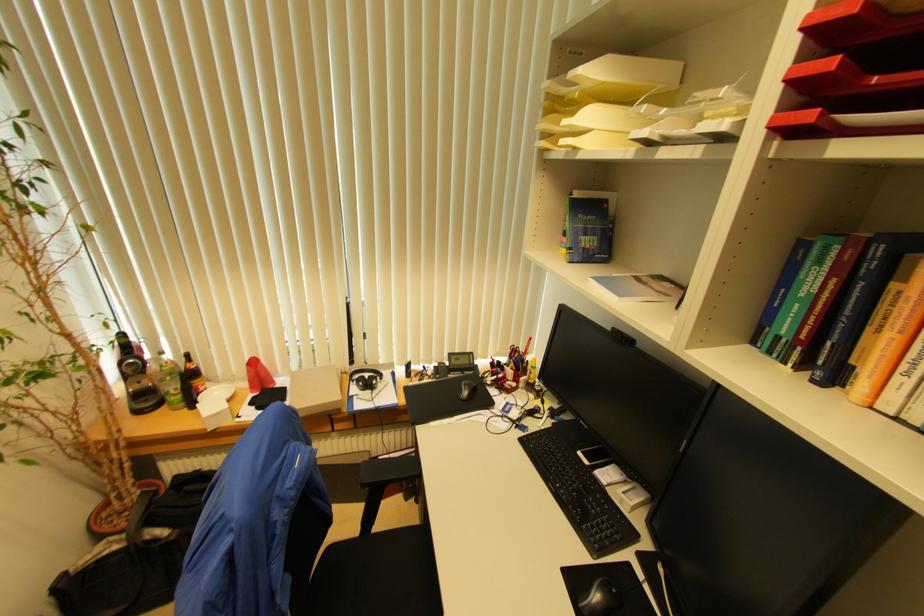
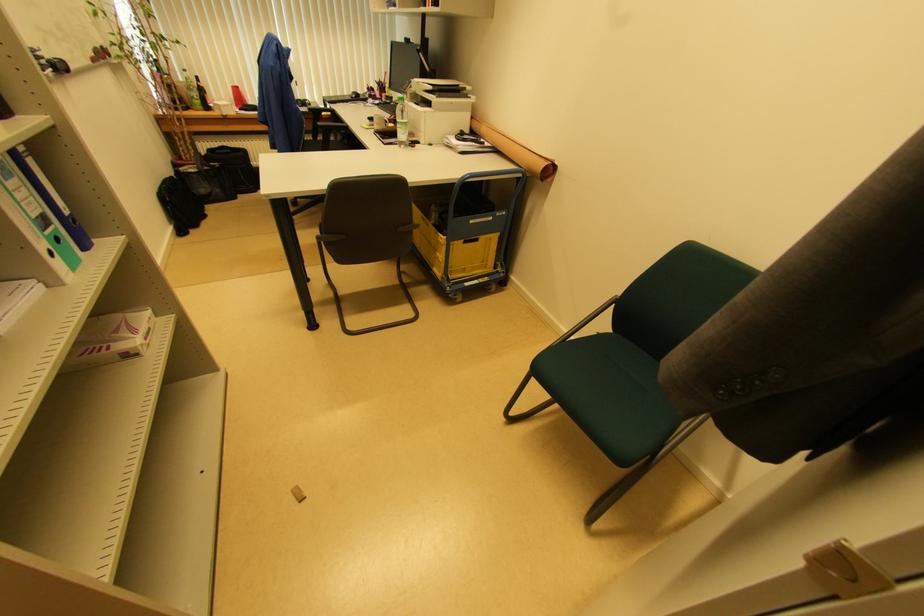
In the second image, find the point that corresponds to the point at 180,389 in the first image.

(200, 98)